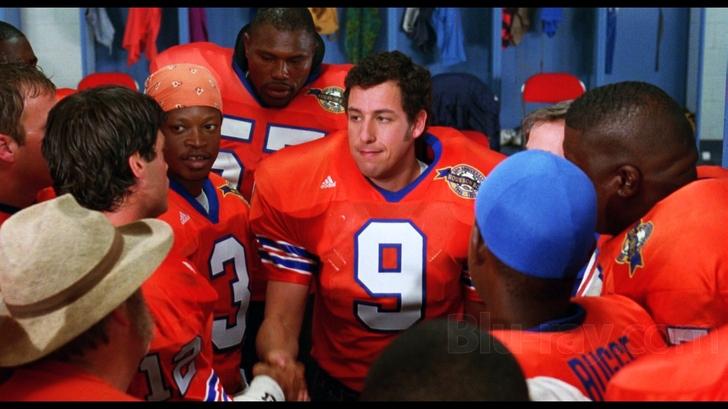
The image size is (728, 409). Find the location of `locker`. locker is located at coordinates (649, 48), (534, 39), (455, 39), (351, 18), (199, 15), (122, 31).